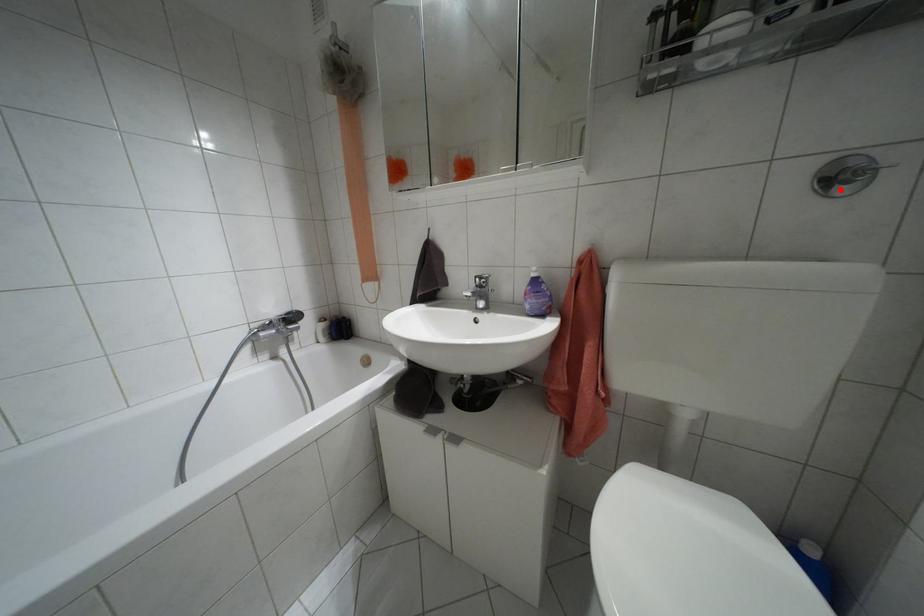
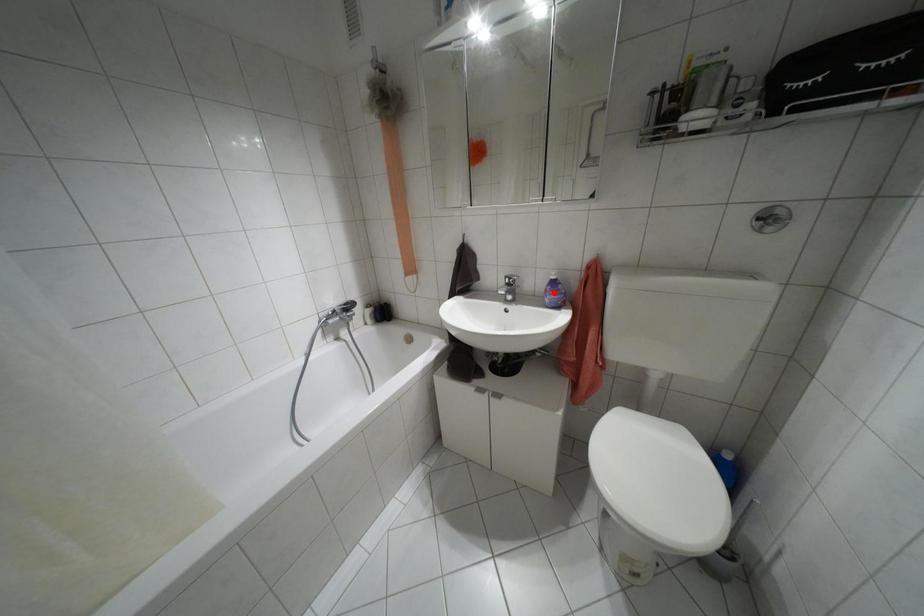
I am providing you with two images of the same scene from different viewpoints. A red point is marked on the first image and another point is marked on the second image. Is the red point in image1 aligned with the point shown in image2?

No